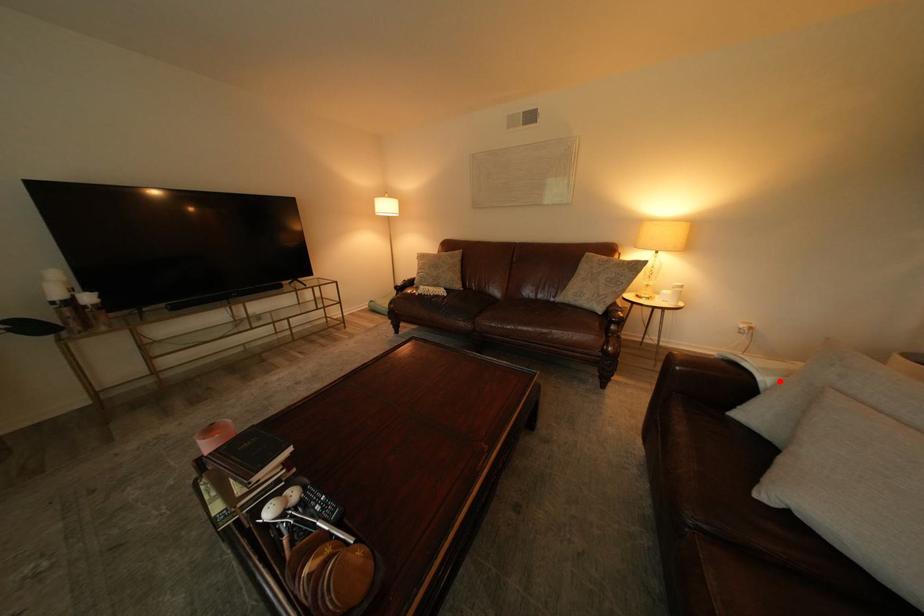
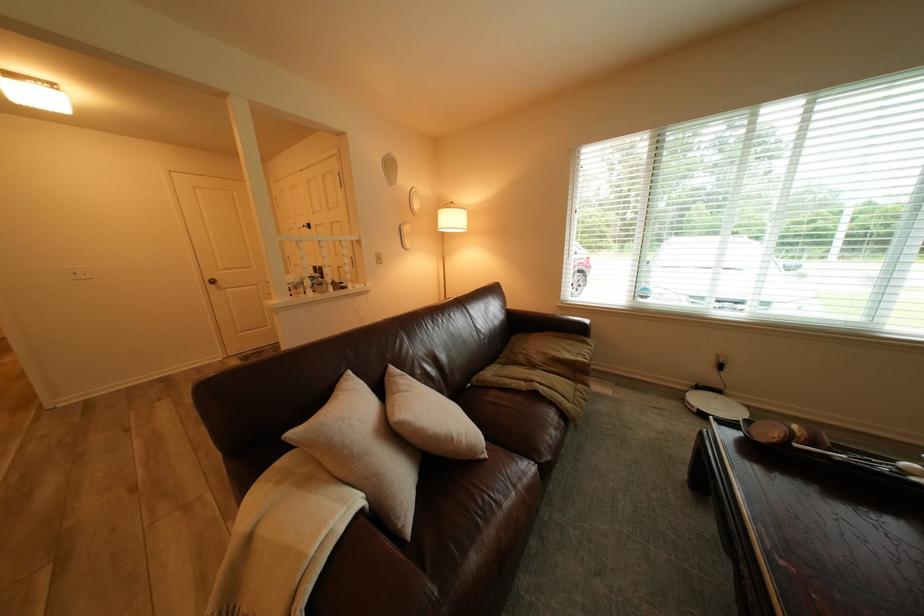
Find the pixel in the second image that matches the highlighted location in the first image.

(372, 500)